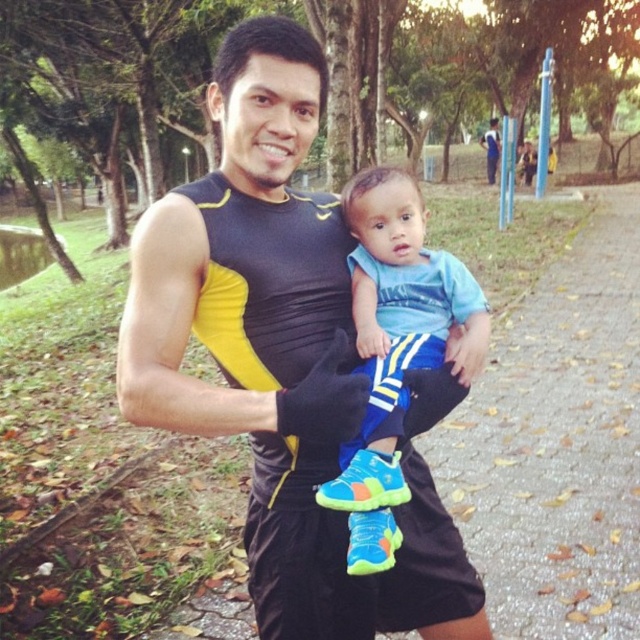
Does point (301, 371) come behind point (384, 314)?

No, it is not.

Does black/yellow athletic top at center appear on the left side of blue fabric pants at center?

Yes, black/yellow athletic top at center is to the left of blue fabric pants at center.

Where is `black/yellow athletic top at center`? This screenshot has height=640, width=640. black/yellow athletic top at center is located at coordinates coord(280,356).

Between blue fabric pants at center and blue fabric shirt at upper center, which one is positioned lower?

blue fabric pants at center is below.

Which is in front, point (465, 376) or point (490, 122)?

Point (465, 376) is in front.

At what (x,y) coordinates should I click in order to perform the action: click on blue fabric pants at center. Please return your answer as a coordinate pair (x, y). Looking at the image, I should click on (396, 348).

Identify the location of black/yellow athletic top at center. The image size is (640, 640). (280, 356).

Is point (170, 428) behind point (496, 125)?

That is False.

Does point (180, 240) come in front of point (492, 124)?

Yes, it is in front of point (492, 124).

Find the location of a particular element. black/yellow athletic top at center is located at coordinates (280, 356).